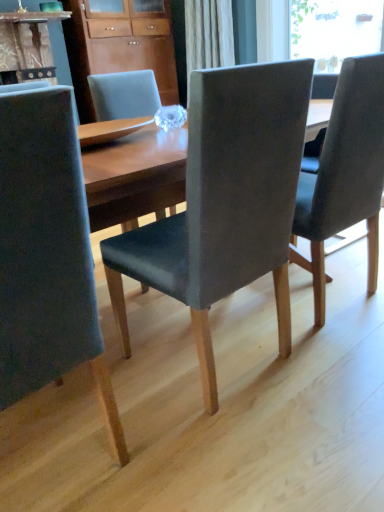
The width and height of the screenshot is (384, 512). Describe the element at coordinates (132, 41) in the screenshot. I see `matte wood cabinet at upper center` at that location.

What do you see at coordinates (345, 174) in the screenshot? The image size is (384, 512). I see `dark gray fabric chair at center, acting as the third chair starting from the left` at bounding box center [345, 174].

Where is `transparent glass window at upper right`? Image resolution: width=384 pixels, height=512 pixels. transparent glass window at upper right is located at coordinates click(x=335, y=30).

From a real-world perspective, between matte wood cabinet at upper center and matte gray chair at center, acting as the second chair starting from the left, who is vertically higher?

matte wood cabinet at upper center is physically above.

Between matte wood cabinet at upper center and matte gray chair at center, positioned as the second chair in right-to-left order, which one has less height?

Standing shorter between the two is matte gray chair at center, positioned as the second chair in right-to-left order.

From the picture: Would you consider matte wood cabinet at upper center to be distant from matte gray chair at center, acting as the second chair starting from the left?

Yes.

In the scene shown: From the image's perspective, is matte wood cabinet at upper center under matte gray chair at center, acting as the second chair starting from the left?

No, from the image's perspective, matte wood cabinet at upper center is not beneath matte gray chair at center, acting as the second chair starting from the left.

Is matte gray chair at center, acting as the second chair starting from the left, wider than transparent glass window at upper right?

Correct, the width of matte gray chair at center, acting as the second chair starting from the left, exceeds that of transparent glass window at upper right.

Is transparent glass window at upper right at the back of matte gray chair at center, positioned as the second chair in right-to-left order?

No, matte gray chair at center, positioned as the second chair in right-to-left order, is not facing the opposite direction of transparent glass window at upper right.

Does matte gray chair at center, acting as the second chair starting from the left, have a lesser height compared to transparent glass window at upper right?

No.

Is matte wood cabinet at upper center positioned with its back to transparent glass window at upper right?

No, matte wood cabinet at upper center's orientation is not away from transparent glass window at upper right.

Does matte wood cabinet at upper center come in front of transparent glass window at upper right?

No, matte wood cabinet at upper center is behind transparent glass window at upper right.

Is matte wood cabinet at upper center not near transparent glass window at upper right?

Yes.

Which object is positioned more to the right, matte wood cabinet at upper center or transparent glass window at upper right?

Positioned to the right is transparent glass window at upper right.

Is matte gray chair at left, which appears as the third chair when viewed from the right, turned away from transparent glass window at upper right?

No, transparent glass window at upper right is not at the back of matte gray chair at left, which appears as the third chair when viewed from the right.

From the image's perspective, which chair is the 3rd one below the transparent glass window at upper right? Please provide its 2D coordinates.

[(47, 256)]

Is matte gray chair at left, which appears as the third chair when viewed from the right, shorter than matte wood cabinet at upper center?

Yes.

Which object is further away from the camera taking this photo, matte gray chair at left, which appears as the third chair when viewed from the right, or matte wood cabinet at upper center?

matte wood cabinet at upper center is further away from the camera.

How far apart are matte gray chair at left, arranged as the 1th chair when viewed from the left, and matte wood cabinet at upper center?

A distance of 3.08 meters exists between matte gray chair at left, arranged as the 1th chair when viewed from the left, and matte wood cabinet at upper center.

Is matte gray chair at left, which appears as the third chair when viewed from the right, smaller than matte wood cabinet at upper center?

Indeed, matte gray chair at left, which appears as the third chair when viewed from the right, has a smaller size compared to matte wood cabinet at upper center.

Is matte gray chair at center, positioned as the second chair in right-to-left order, inside or outside of matte wood cabinet at upper center?

matte gray chair at center, positioned as the second chair in right-to-left order, cannot be found inside matte wood cabinet at upper center.

Is the position of matte gray chair at center, positioned as the second chair in right-to-left order, less distant than that of matte wood cabinet at upper center?

Yes.

Based on their positions, is matte gray chair at center, acting as the second chair starting from the left, located to the left or right of matte wood cabinet at upper center?

In the image, matte gray chair at center, acting as the second chair starting from the left, appears on the right side of matte wood cabinet at upper center.

From the image's perspective, is matte gray chair at center, positioned as the second chair in right-to-left order, on top of matte wood cabinet at upper center?

No, from the image's perspective, matte gray chair at center, positioned as the second chair in right-to-left order, is not over matte wood cabinet at upper center.

Can you confirm if transparent glass window at upper right is positioned to the left of matte wood cabinet at upper center?

No.

Identify the location of window screen located above the matte wood cabinet at upper center (from a real-world perspective). (335, 30).

Are transparent glass window at upper right and matte wood cabinet at upper center located far from each other?

Indeed, transparent glass window at upper right is not near matte wood cabinet at upper center.

Does point (346, 8) come in front of point (93, 62)?

No, (346, 8) is further to viewer.

Where is `the 2nd chair in front of the matte wood cabinet at upper center`? the 2nd chair in front of the matte wood cabinet at upper center is located at coordinates (225, 203).

Identify the location of window screen above the matte gray chair at center, positioned as the second chair in right-to-left order (from a real-world perspective). The width and height of the screenshot is (384, 512). (335, 30).

From the image, which object appears to be farther from matte gray chair at left, arranged as the 1th chair when viewed from the left, transparent glass window at upper right or matte gray chair at center, acting as the second chair starting from the left?

transparent glass window at upper right lies further to matte gray chair at left, arranged as the 1th chair when viewed from the left, than the other object.

Which object lies nearer to the anchor point matte wood cabinet at upper center, dark gray fabric chair at center, acting as the third chair starting from the left, or matte gray chair at left, arranged as the 1th chair when viewed from the left?

Based on the image, dark gray fabric chair at center, acting as the third chair starting from the left, appears to be nearer to matte wood cabinet at upper center.

From the image, which object appears to be nearer to matte gray chair at center, acting as the second chair starting from the left, matte gray chair at left, arranged as the 1th chair when viewed from the left, or transparent glass window at upper right?

matte gray chair at left, arranged as the 1th chair when viewed from the left, is closer to matte gray chair at center, acting as the second chair starting from the left.

Estimate the real-world distances between objects in this image. Which object is further from matte wood cabinet at upper center, matte gray chair at center, positioned as the second chair in right-to-left order, or transparent glass window at upper right?

matte gray chair at center, positioned as the second chair in right-to-left order.

From the image, which object appears to be nearer to matte gray chair at center, positioned as the second chair in right-to-left order, dark gray fabric chair at center, acting as the third chair starting from the left, or matte wood cabinet at upper center?

dark gray fabric chair at center, acting as the third chair starting from the left, is closer to matte gray chair at center, positioned as the second chair in right-to-left order.

Estimate the real-world distances between objects in this image. Which object is further from dark gray fabric chair at center, acting as the 1th chair starting from the right, matte gray chair at center, positioned as the second chair in right-to-left order, or transparent glass window at upper right?

transparent glass window at upper right is positioned further to the anchor dark gray fabric chair at center, acting as the 1th chair starting from the right.

Based on their spatial positions, is transparent glass window at upper right or matte gray chair at left, which appears as the third chair when viewed from the right, closer to dark gray fabric chair at center, acting as the third chair starting from the left?

The object closer to dark gray fabric chair at center, acting as the third chair starting from the left, is matte gray chair at left, which appears as the third chair when viewed from the right.

Based on their spatial positions, is matte wood cabinet at upper center or matte gray chair at center, positioned as the second chair in right-to-left order, closer to matte gray chair at left, arranged as the 1th chair when viewed from the left?

Among the two, matte gray chair at center, positioned as the second chair in right-to-left order, is located nearer to matte gray chair at left, arranged as the 1th chair when viewed from the left.

Locate an element on the screen. Image resolution: width=384 pixels, height=512 pixels. window screen between matte gray chair at left, which appears as the third chair when viewed from the right, and matte wood cabinet at upper center in the front-back direction is located at coordinates 335,30.

This screenshot has width=384, height=512. I want to click on window screen positioned between dark gray fabric chair at center, acting as the third chair starting from the left, and matte wood cabinet at upper center from near to far, so click(x=335, y=30).

Locate an element on the screen. chair between matte gray chair at center, acting as the second chair starting from the left, and matte wood cabinet at upper center in the front-back direction is located at coordinates tap(345, 174).

Where is `chair positioned between matte gray chair at center, acting as the second chair starting from the left, and transparent glass window at upper right from near to far`? This screenshot has height=512, width=384. chair positioned between matte gray chair at center, acting as the second chair starting from the left, and transparent glass window at upper right from near to far is located at coordinates (345, 174).